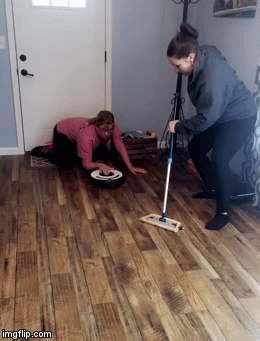
Where is `black floor lamp`? This screenshot has width=260, height=341. black floor lamp is located at coordinates (181, 91).